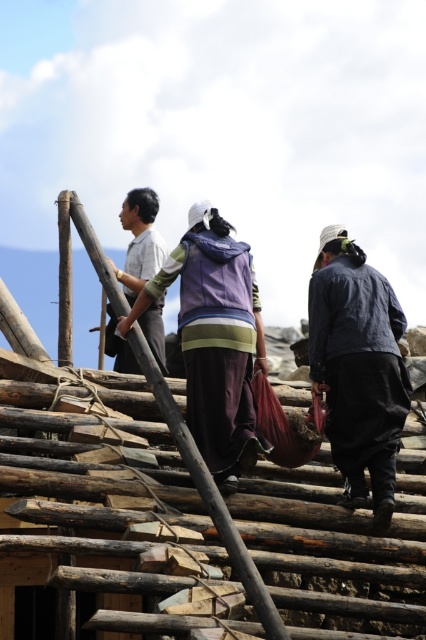
You are standing at the point labeled as point (334, 333) and want to reach the construction site located 157.08 feet away. Can you estimate how far you need to walk to get there?

The distance between you and the construction site is exactly 157.08 feet, so you need to walk 157.08 feet to reach it.

You are standing at the base of the wooden structure and want to hand a tool to both the person wearing the dark blue fabric at center and the one in the light gray striped shirt at upper left. Which person should you hand the tool to first based on their proximity to you?

You should hand the tool to the dark blue fabric at center first because it is closer to you than the light gray striped shirt at upper left.

Based on the photo, you are standing in the middle of the construction site and see the dark blue fabric at center and the purple fabric at center. Which fabric is positioned to the right side?

The dark blue fabric at center is positioned to the right of the purple fabric at center.